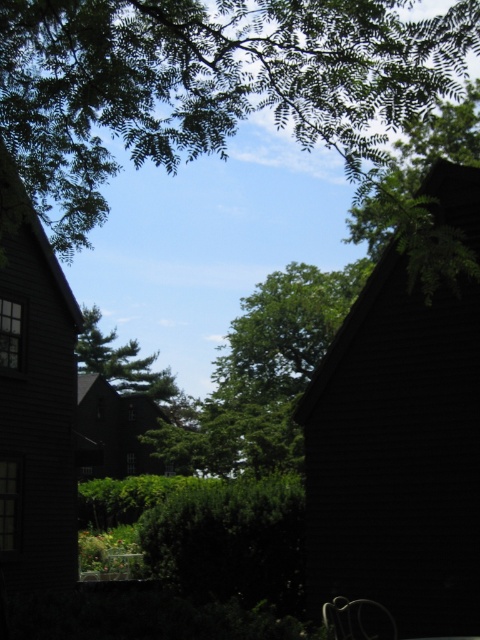
Does green leafy tree at upper center have a greater height compared to green matte tree at center?

Yes, green leafy tree at upper center is taller than green matte tree at center.

Who is lower down, green leafy tree at upper center or green matte tree at center?

green matte tree at center is lower down.

Does point (63, 97) come behind point (126, 353)?

That is False.

The image size is (480, 640). In order to click on green leafy tree at upper center in this screenshot , I will do `click(203, 84)`.

Who is more forward, (13, 29) or (331, 637)?

Positioned in front is point (13, 29).

Describe the element at coordinates (203, 84) in the screenshot. I see `green leafy tree at upper center` at that location.

Which is behind, point (64, 166) or point (337, 602)?

Positioned behind is point (337, 602).

Identify the location of green leafy tree at upper center. (203, 84).

Does green matte tree at center have a lesser width compared to metallic silver chair at lower right?

In fact, green matte tree at center might be wider than metallic silver chair at lower right.

Does green matte tree at center appear under metallic silver chair at lower right?

No, green matte tree at center is not below metallic silver chair at lower right.

Does point (91, 333) lie behind point (358, 612)?

Yes, it is.

I want to click on green matte tree at center, so (120, 362).